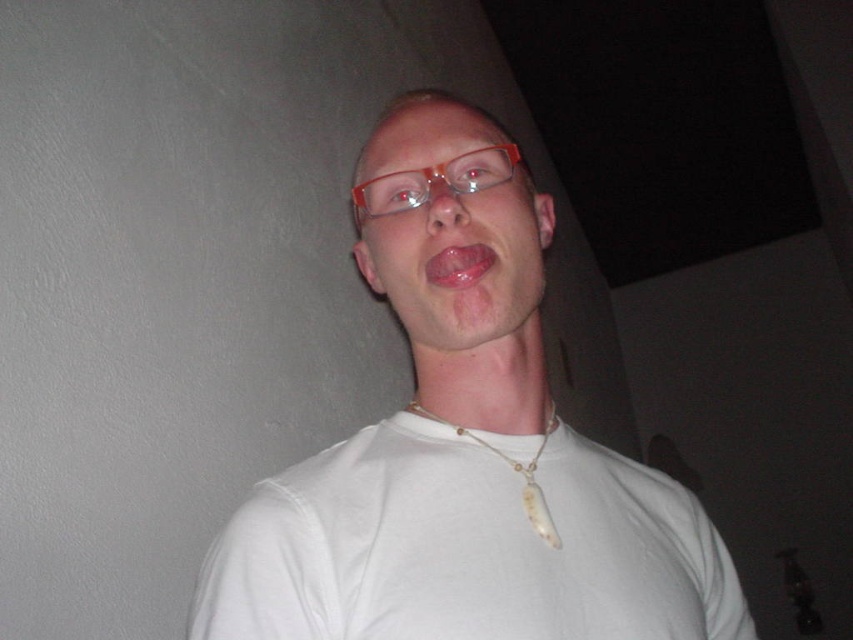
Is white matte necklace at center to the right of pink glossy tongue at center from the viewer's perspective?

Correct, you'll find white matte necklace at center to the right of pink glossy tongue at center.

Is white matte necklace at center to the left of pink glossy tongue at center from the viewer's perspective?

Incorrect, white matte necklace at center is not on the left side of pink glossy tongue at center.

Locate an element on the screen. This screenshot has height=640, width=853. white matte necklace at center is located at coordinates (465, 451).

Locate an element on the screen. white matte necklace at center is located at coordinates (465, 451).

Describe the element at coordinates (468, 545) in the screenshot. I see `white cotton shirt at center` at that location.

Does white cotton shirt at center have a smaller size compared to white bone necklace at center?

Actually, white cotton shirt at center might be larger than white bone necklace at center.

Where is `white cotton shirt at center`? white cotton shirt at center is located at coordinates (468, 545).

Find the location of `white cotton shirt at center`. white cotton shirt at center is located at coordinates (468, 545).

Can you confirm if white cotton shirt at center is positioned to the left of translucent orange glasses at center?

No, white cotton shirt at center is not to the left of translucent orange glasses at center.

Is point (437, 604) less distant than point (469, 180)?

Yes, point (437, 604) is in front of point (469, 180).

Locate an element on the screen. This screenshot has width=853, height=640. white cotton shirt at center is located at coordinates (468, 545).